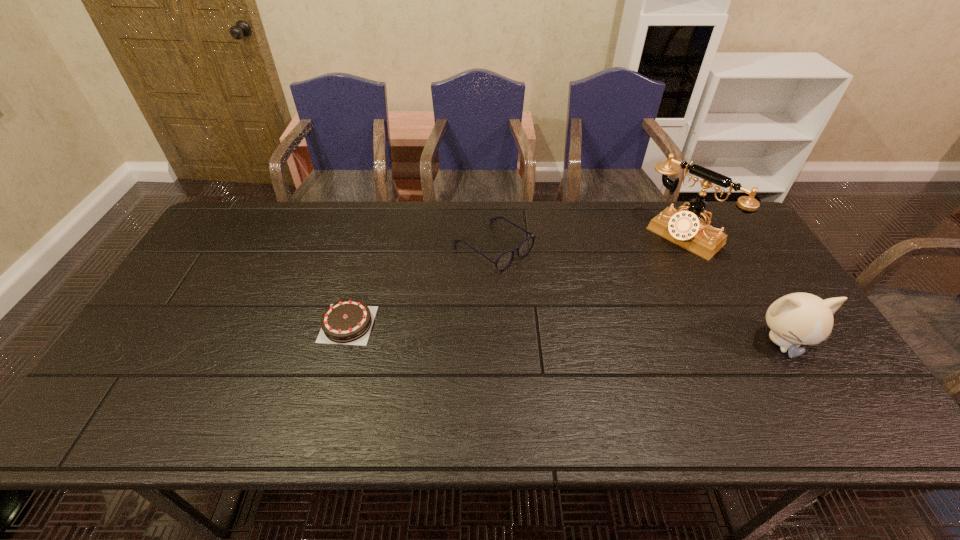
The width and height of the screenshot is (960, 540). In order to click on vacant space that's between the telephone and the second object from left to right in this screenshot , I will do `click(588, 241)`.

This screenshot has width=960, height=540. Find the location of `free space between the shortest object and the second tallest object`. free space between the shortest object and the second tallest object is located at coordinates (564, 333).

At what (x,y) coordinates should I click in order to perform the action: click on vacant area that lies between the telephone and the chocolate cake. Please return your answer as a coordinate pair (x, y). Looking at the image, I should click on (516, 280).

Where is `vacant space that's between the telephone and the leftmost object`? The image size is (960, 540). vacant space that's between the telephone and the leftmost object is located at coordinates (516, 280).

Where is `the second closest object to the second object from left to right`? This screenshot has height=540, width=960. the second closest object to the second object from left to right is located at coordinates (687, 229).

Locate an element on the screen. object that stands as the closest to the chocolate cake is located at coordinates (505, 259).